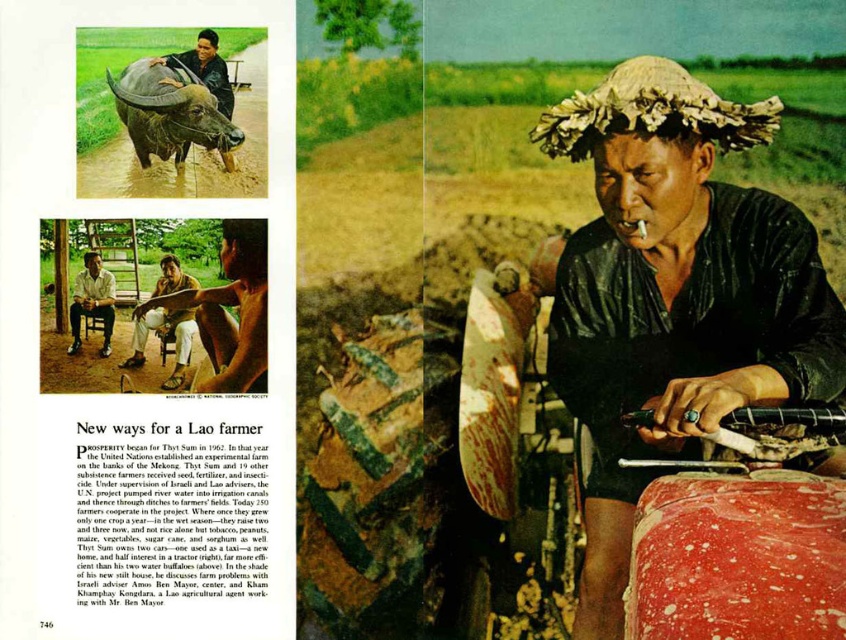
Question: Is wet black shirt at center positioned before brown leather shirt at center?

Choices:
 (A) no
 (B) yes

Answer: (B)

Question: Among these points, which one is nearest to the camera?

Choices:
 (A) (722, 298)
 (B) (113, 321)
 (C) (160, 326)

Answer: (A)

Question: Estimate the real-world distances between objects in this image. Which object is farther from the wet black shirt at center?

Choices:
 (A) light brown wooden chair at lower left
 (B) brown leather shirt at center

Answer: (A)

Question: Is wet black shirt at center positioned in front of brown leather shirt at center?

Choices:
 (A) yes
 (B) no

Answer: (A)

Question: Which object appears closest to the camera in this image?

Choices:
 (A) wet black shirt at center
 (B) light brown wooden chair at lower left
 (C) brown leather shirt at center

Answer: (A)

Question: In this image, where is brown leather shirt at center located relative to light brown wooden chair at lower left?

Choices:
 (A) left
 (B) right

Answer: (B)